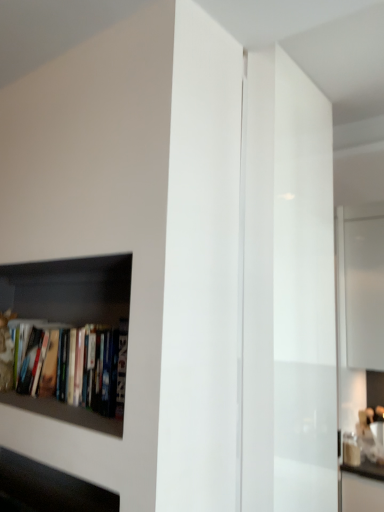
At what (x,y) coordinates should I click in order to perform the action: click on hardcover books at left. Please return your answer as a coordinate pair (x, y). The width and height of the screenshot is (384, 512). Looking at the image, I should click on (90, 367).

What do you see at coordinates (90, 367) in the screenshot? I see `hardcover books at left` at bounding box center [90, 367].

The height and width of the screenshot is (512, 384). I want to click on hardcover books at left, so click(x=90, y=367).